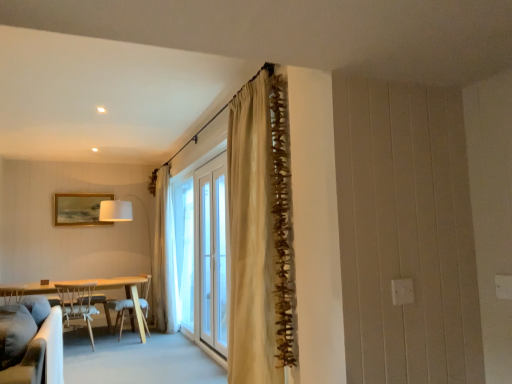
Describe the element at coordinates (115, 211) in the screenshot. I see `white fabric lampshade at left` at that location.

This screenshot has width=512, height=384. Describe the element at coordinates (31, 342) in the screenshot. I see `soft gray fabric couch at lower left` at that location.

What do you see at coordinates (79, 209) in the screenshot? I see `gold-framed painting at upper left` at bounding box center [79, 209].

Image resolution: width=512 pixels, height=384 pixels. Describe the element at coordinates (207, 258) in the screenshot. I see `white glass screen door at center` at that location.

Describe the element at coordinates (133, 306) in the screenshot. I see `wooden chair at lower left, which is the 1th chair in back-to-front order` at that location.

This screenshot has height=384, width=512. In order to click on white wood chair at left, which is the 2th chair in back-to-front order in this screenshot , I will do click(77, 304).

Between light wood table at left and white fabric lampshade at left, which one has less height?

light wood table at left is shorter.

From a real-world perspective, is light wood table at left physically below white fabric lampshade at left?

Yes, from a real-world perspective, light wood table at left is under white fabric lampshade at left.

Is light wood table at left closer to the viewer compared to white fabric lampshade at left?

Yes, light wood table at left is closer to the viewer.

Is white fabric lampshade at left not close to white wood chair at left, the first chair in the front-to-back sequence?

Yes, white fabric lampshade at left is far from white wood chair at left, the first chair in the front-to-back sequence.

Between white fabric lampshade at left and white wood chair at left, which is the 2th chair in back-to-front order, which one has smaller size?

white wood chair at left, which is the 2th chair in back-to-front order, is smaller.

From a real-world perspective, is white fabric lampshade at left positioned over white wood chair at left, which is the 2th chair in back-to-front order, based on gravity?

Indeed, from a real-world perspective, white fabric lampshade at left stands above white wood chair at left, which is the 2th chair in back-to-front order.

Is white fabric lampshade at left wider than white wood chair at left, which is the 2th chair in back-to-front order?

Yes.

From a real-world perspective, is light wood table at left located higher than wooden chair at lower left, which is counted as the second chair, starting from the front?

Actually, light wood table at left is physically below wooden chair at lower left, which is counted as the second chair, starting from the front, in the real world.

Looking at this image, is light wood table at left taller or shorter than wooden chair at lower left, which is counted as the second chair, starting from the front?

Considering their sizes, light wood table at left has less height than wooden chair at lower left, which is counted as the second chair, starting from the front.

From the image's perspective, which object appears higher, light wood table at left or wooden chair at lower left, which is the 1th chair in back-to-front order?

wooden chair at lower left, which is the 1th chair in back-to-front order.

Can you see white glass screen door at center touching white fabric lampshade at left?

They are not placed beside each other.

How distant is white glass screen door at center from white fabric lampshade at left?

white glass screen door at center is 8.76 feet away from white fabric lampshade at left.

How many degrees apart are the facing directions of white glass screen door at center and white fabric lampshade at left?

92.2 degrees separate the facing orientations of white glass screen door at center and white fabric lampshade at left.

From the image's perspective, which object appears higher, white glass screen door at center or white fabric lampshade at left?

white glass screen door at center, from the image's perspective.

From a real-world perspective, which object stands above the other?

beige fabric curtain at center, the first curtain positioned from the front.

Is beige fabric curtain at center, positioned as the second curtain in back-to-front order, wider or thinner than white glass screen door at center?

beige fabric curtain at center, positioned as the second curtain in back-to-front order, is wider than white glass screen door at center.

Is there a large distance between beige fabric curtain at center, positioned as the second curtain in back-to-front order, and white glass screen door at center?

Yes, beige fabric curtain at center, positioned as the second curtain in back-to-front order, and white glass screen door at center are quite far apart.

Can you tell me how much beige fabric curtain at center, positioned as the second curtain in back-to-front order, and white glass screen door at center differ in facing direction?

The facing directions of beige fabric curtain at center, positioned as the second curtain in back-to-front order, and white glass screen door at center are 1.69 degrees apart.

Is white wood chair at left, which is the 2th chair in back-to-front order, facing towards white fabric lampshade at left?

No, white wood chair at left, which is the 2th chair in back-to-front order, is not oriented towards white fabric lampshade at left.

From the image's perspective, would you say white wood chair at left, the first chair in the front-to-back sequence, is shown under white fabric lampshade at left?

Yes, from the image's perspective, white wood chair at left, the first chair in the front-to-back sequence, is below white fabric lampshade at left.

Are white wood chair at left, which is the 2th chair in back-to-front order, and white fabric lampshade at left making contact?

No, white wood chair at left, which is the 2th chair in back-to-front order, is not touching white fabric lampshade at left.

Is white wood chair at left, which is the 2th chair in back-to-front order, inside or outside of white fabric lampshade at left?

white wood chair at left, which is the 2th chair in back-to-front order, is outside white fabric lampshade at left.

Is white wood chair at left, the first chair in the front-to-back sequence, surrounded by translucent fabric window at center?

No, white wood chair at left, the first chair in the front-to-back sequence, is not surrounded by translucent fabric window at center.

How distant is translucent fabric window at center from white wood chair at left, the first chair in the front-to-back sequence?

translucent fabric window at center and white wood chair at left, the first chair in the front-to-back sequence, are 1.45 meters apart from each other.

From the image's perspective, is translucent fabric window at center beneath white wood chair at left, which is the 2th chair in back-to-front order?

No, from the image's perspective, translucent fabric window at center is not below white wood chair at left, which is the 2th chair in back-to-front order.

From a real-world perspective, is translucent fabric window at center physically above white wood chair at left, the first chair in the front-to-back sequence?

Indeed, from a real-world perspective, translucent fabric window at center stands above white wood chair at left, the first chair in the front-to-back sequence.

The height and width of the screenshot is (384, 512). What are the coordinates of `kitchen & dining room table to the left of white fabric lampshade at left` in the screenshot? It's located at (95, 288).

The height and width of the screenshot is (384, 512). What are the coordinates of `the 2nd chair in front of the white fabric lampshade at left, starting your count from the anchor` in the screenshot? It's located at (77, 304).

Estimate the real-world distances between objects in this image. Which object is closer to light wood table at left, beige fabric curtain at center, marked as the second curtain in a left-to-right arrangement, or white fabric lampshade at left?

white fabric lampshade at left is closer to light wood table at left.

Which object lies further to the anchor point soft gray fabric couch at lower left, beige textured curtain at center, which is counted as the 1th curtain, starting from the back, or beige fabric curtain at center, marked as the second curtain in a left-to-right arrangement?

Based on the image, beige textured curtain at center, which is counted as the 1th curtain, starting from the back, appears to be further to soft gray fabric couch at lower left.

Based on their spatial positions, is wooden chair at lower left, which is counted as the second chair, starting from the front, or beige textured curtain at center, which is counted as the 1th curtain, starting from the back, further from white fabric lampshade at left?

wooden chair at lower left, which is counted as the second chair, starting from the front, is further to white fabric lampshade at left.

From the image, which object appears to be nearer to translucent fabric window at center, light wood table at left or beige textured curtain at center, which is the second curtain from right to left?

The object closer to translucent fabric window at center is beige textured curtain at center, which is the second curtain from right to left.

When comparing their distances from white wood chair at left, which is the 2th chair in back-to-front order, does soft gray fabric couch at lower left or beige textured curtain at center, which is the second curtain from right to left, seem further?

soft gray fabric couch at lower left lies further to white wood chair at left, which is the 2th chair in back-to-front order, than the other object.

Considering their positions, is soft gray fabric couch at lower left positioned further to translucent fabric window at center than white wood chair at left, which is the 2th chair in back-to-front order?

soft gray fabric couch at lower left is positioned further to the anchor translucent fabric window at center.

When comparing their distances from white fabric lampshade at left, does translucent fabric window at center or light wood table at left seem closer?

Based on the image, light wood table at left appears to be nearer to white fabric lampshade at left.

Based on the photo, looking at the image, which one is located closer to white fabric lampshade at left, gold-framed painting at upper left or beige fabric curtain at center, positioned as the second curtain in back-to-front order?

gold-framed painting at upper left is positioned closer to the anchor white fabric lampshade at left.

Find the location of a particular element. This screenshot has width=512, height=384. curtain between soft gray fabric couch at lower left and white wood chair at left, which is the 2th chair in back-to-front order, in the front-back direction is located at coordinates (253, 232).

Identify the location of chair positioned between light wood table at left and beige textured curtain at center, which is the second curtain from right to left, from near to far. The image size is (512, 384). (x=133, y=306).

Identify the location of screen door located between beige fabric curtain at center, the first curtain positioned from the front, and beige textured curtain at center, placed as the 1th curtain when sorted from left to right, in the depth direction. This screenshot has width=512, height=384. (207, 258).

The width and height of the screenshot is (512, 384). Find the location of `lamp between soft gray fabric couch at lower left and beige textured curtain at center, the second curtain viewed from the front, from front to back`. lamp between soft gray fabric couch at lower left and beige textured curtain at center, the second curtain viewed from the front, from front to back is located at coordinates (115, 211).